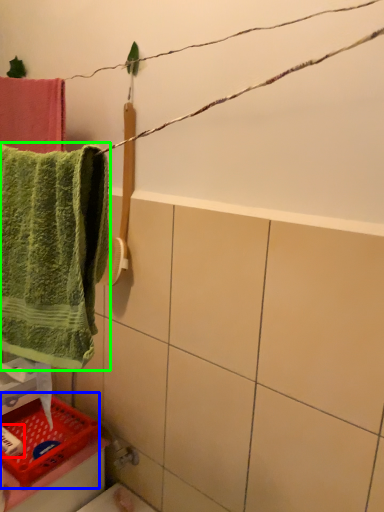
Question: Which is farther away from toiletry (highlighted by a red box)? basket (highlighted by a blue box) or towel (highlighted by a green box)?

Choices:
 (A) basket
 (B) towel

Answer: (B)